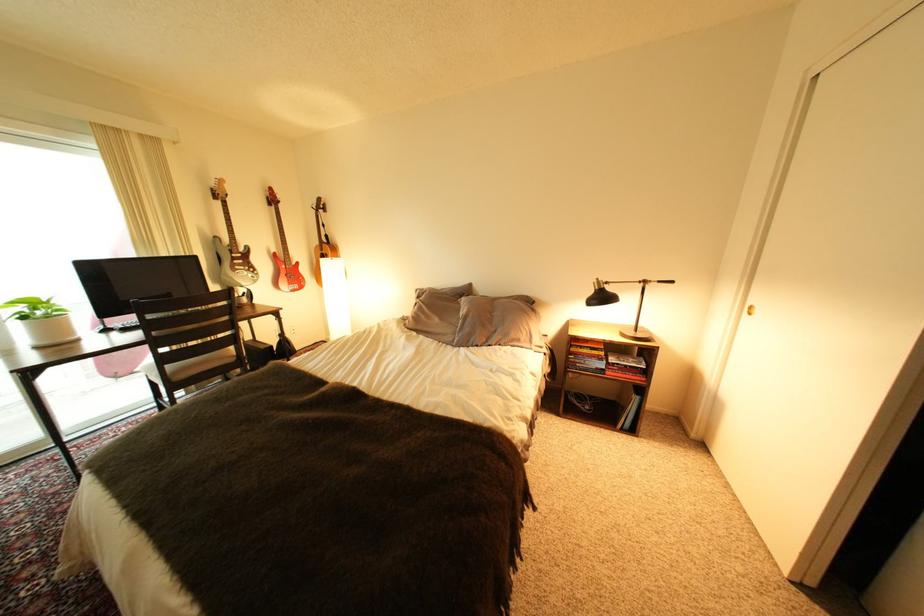
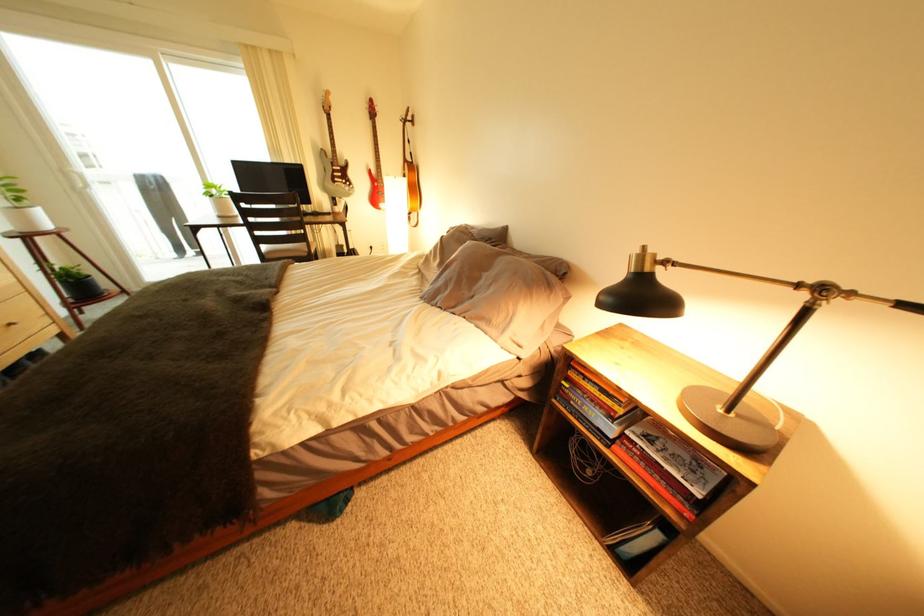
Where in the second image is the point corresponding to the point at 37,318 from the first image?

(225, 198)